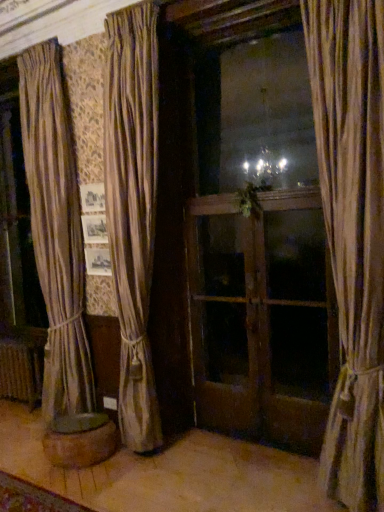
In order to click on vacant region in front of silky beige curtain at center, which appears as the 2th curtain when viewed from the right in this screenshot , I will do `click(147, 477)`.